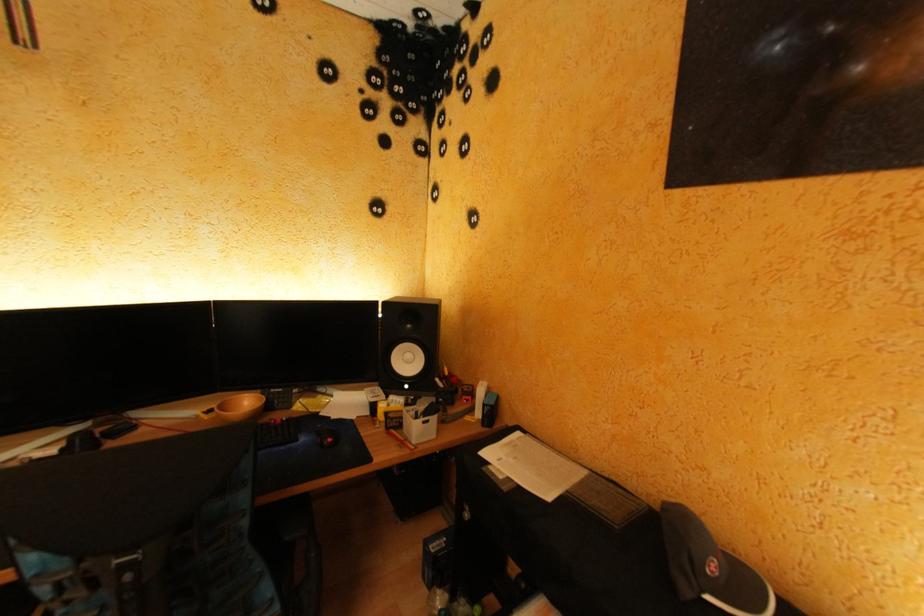
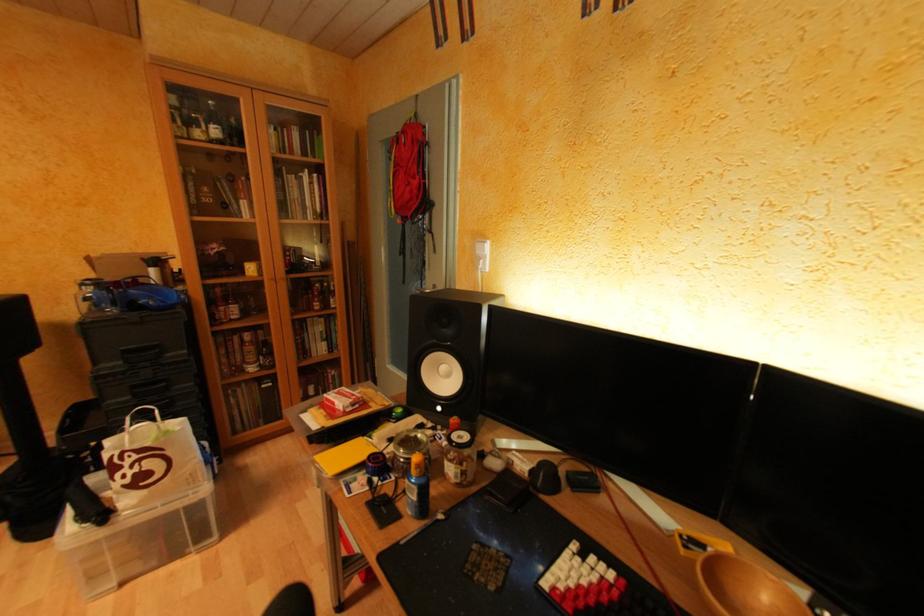
Question: Based on the continuous images, in which direction is the camera rotating? Reply with the corresponding letter.

Choices:
 (A) Left
 (B) Right
 (C) Up
 (D) Down

Answer: (A)